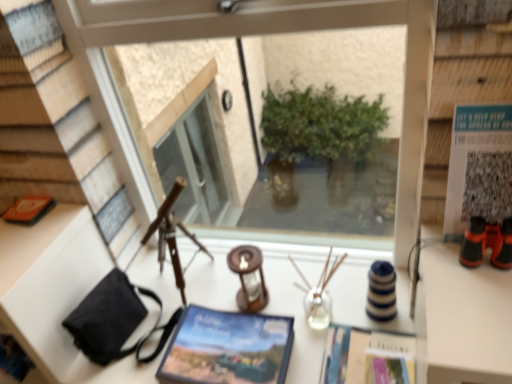
Locate an element on the screen. This screenshot has height=384, width=512. free spot in front of orange matte book at left is located at coordinates (22, 241).